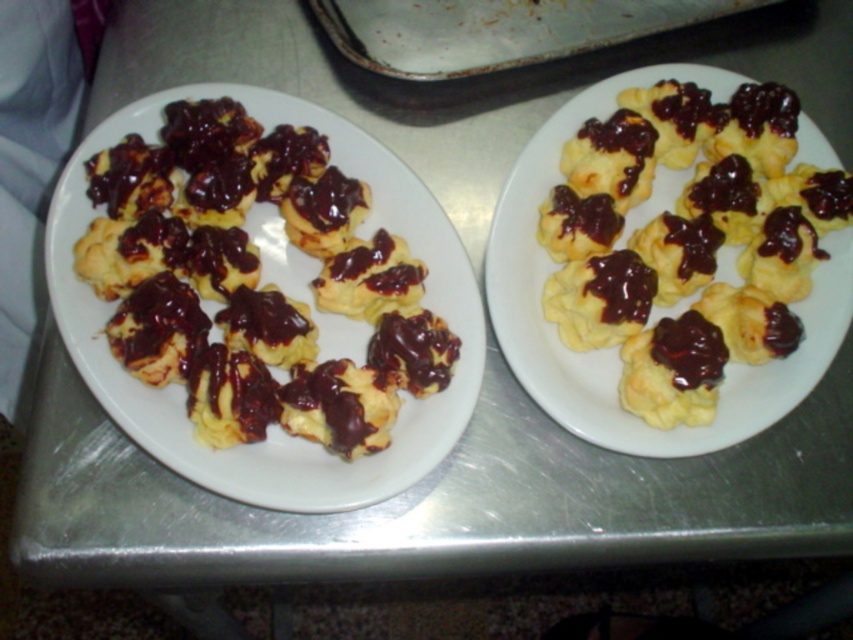
You are a chef who needs to locate the yellow matte puff pastry at center in the image. Could you tell me the exact coordinates where it is positioned?

The yellow matte puff pastry at center is located at point (x=614, y=348).

You are a chef preparing desserts and need to place a yellow matte puff pastry at center onto a brushed metal tray at upper center. Can you place it to the left side of the tray?

The yellow matte puff pastry at center is currently positioned on the right side of the brushed metal tray at upper center, so you can move it to the left side of the tray.

You are a baker who needs to arrange pastries on a display. You have two options for placement based on their widths. The matte yellow puff pastries at left and the yellow matte puff pastry at center. Which pastry should you choose if you want to place a wider pastry on the left side of the display?

A: The matte yellow puff pastries at left might be wider than the yellow matte puff pastry at center, so you should choose the matte yellow puff pastries at left for the left side of the display to ensure a wider pastry is placed there.